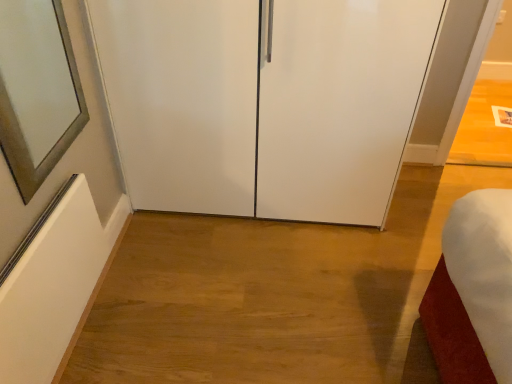
Locate an element on the screen. transparent glass cabinet at center is located at coordinates (264, 102).

Describe the element at coordinates (264, 102) in the screenshot. I see `transparent glass cabinet at center` at that location.

Describe the element at coordinates (24, 131) in the screenshot. The image size is (512, 384). I see `satin silver mirror at left` at that location.

You are a GUI agent. You are given a task and a screenshot of the screen. Output one action in this format:
    pyautogui.click(x=<x>, y=<y>)
    Task: Click on the satin silver mirror at left
    This screenshot has height=384, width=512.
    Given the screenshot: What is the action you would take?
    pyautogui.click(x=24, y=131)

This screenshot has height=384, width=512. In order to click on transparent glass cabinet at center in this screenshot , I will do `click(264, 102)`.

Considering the relative positions of satin silver mirror at left and transparent glass cabinet at center in the image provided, is satin silver mirror at left to the left of transparent glass cabinet at center from the viewer's perspective?

Yes, satin silver mirror at left is to the left of transparent glass cabinet at center.

In the image, is satin silver mirror at left positioned in front of or behind transparent glass cabinet at center?

Clearly, satin silver mirror at left is in front of transparent glass cabinet at center.

Considering the points (23, 187) and (112, 119), which point is in front, point (23, 187) or point (112, 119)?

Positioned in front is point (23, 187).

From the image's perspective, is satin silver mirror at left under transparent glass cabinet at center?

Indeed, from the image's perspective, satin silver mirror at left is shown beneath transparent glass cabinet at center.

From a real-world perspective, which is physically below, satin silver mirror at left or transparent glass cabinet at center?

In real-world perspective, transparent glass cabinet at center is lower.

Considering the sizes of objects satin silver mirror at left and transparent glass cabinet at center in the image provided, who is wider, satin silver mirror at left or transparent glass cabinet at center?

Wider between the two is transparent glass cabinet at center.

Is satin silver mirror at left taller than transparent glass cabinet at center?

No.

Between satin silver mirror at left and transparent glass cabinet at center, which one has larger size?

With larger size is transparent glass cabinet at center.

Can we say satin silver mirror at left lies outside transparent glass cabinet at center?

Yes, satin silver mirror at left is located beyond the bounds of transparent glass cabinet at center.

Are satin silver mirror at left and transparent glass cabinet at center far apart?

They are positioned close to each other.

Is satin silver mirror at left positioned with its back to transparent glass cabinet at center?

No, transparent glass cabinet at center is not at the back of satin silver mirror at left.

Based on the photo, how much distance is there between satin silver mirror at left and transparent glass cabinet at center?

A distance of 25.09 inches exists between satin silver mirror at left and transparent glass cabinet at center.

This screenshot has height=384, width=512. Identify the location of mirror located below the transparent glass cabinet at center (from the image's perspective). (24, 131).

Consider the image. Considering the positions of objects transparent glass cabinet at center and satin silver mirror at left in the image provided, who is more to the right, transparent glass cabinet at center or satin silver mirror at left?

From the viewer's perspective, transparent glass cabinet at center appears more on the right side.

Which object is more forward, transparent glass cabinet at center or satin silver mirror at left?

satin silver mirror at left is more forward.

Considering the positions of point (280, 89) and point (68, 98), is point (280, 89) closer or farther from the camera than point (68, 98)?

Point (280, 89) is closer to the camera than point (68, 98).

From the image's perspective, is transparent glass cabinet at center located above or below satin silver mirror at left?

transparent glass cabinet at center is situated higher than satin silver mirror at left in the image.

From a real-world perspective, which object rests below the other?

transparent glass cabinet at center is physically lower.

Consider the image. Which object is wider, transparent glass cabinet at center or satin silver mirror at left?

With larger width is transparent glass cabinet at center.

Is transparent glass cabinet at center taller than satin silver mirror at left?

Yes.

Looking at the image, does transparent glass cabinet at center seem bigger or smaller compared to satin silver mirror at left?

Considering their sizes, transparent glass cabinet at center takes up more space than satin silver mirror at left.

Would you say satin silver mirror at left is part of transparent glass cabinet at center's contents?

No, satin silver mirror at left is not inside transparent glass cabinet at center.

Is transparent glass cabinet at center touching satin silver mirror at left?

No, transparent glass cabinet at center is not next to satin silver mirror at left.

Could you tell me if transparent glass cabinet at center is turned towards satin silver mirror at left?

Yes.

What's the angular difference between transparent glass cabinet at center and satin silver mirror at left's facing directions?

The angular difference between transparent glass cabinet at center and satin silver mirror at left is 90.2 degrees.

How far apart are transparent glass cabinet at center and satin silver mirror at left?

The distance of transparent glass cabinet at center from satin silver mirror at left is 25.09 inches.

Image resolution: width=512 pixels, height=384 pixels. I want to click on glass door that is behind the satin silver mirror at left, so click(264, 102).

At what (x,y) coordinates should I click in order to perform the action: click on glass door below the satin silver mirror at left (from a real-world perspective). Please return your answer as a coordinate pair (x, y). Looking at the image, I should click on (264, 102).

Find the location of a particular element. glass door behind the satin silver mirror at left is located at coordinates (264, 102).